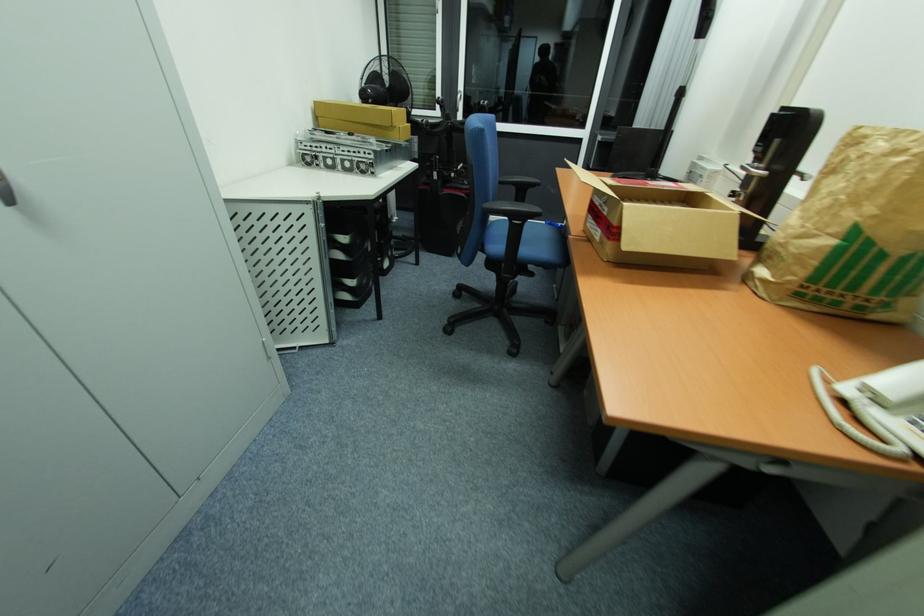
At what (x,y) coordinates should I click in order to perform the action: click on brown paper bag. Please return your answer as a coordinate pair (x, y). The width and height of the screenshot is (924, 616). Looking at the image, I should click on (853, 233).